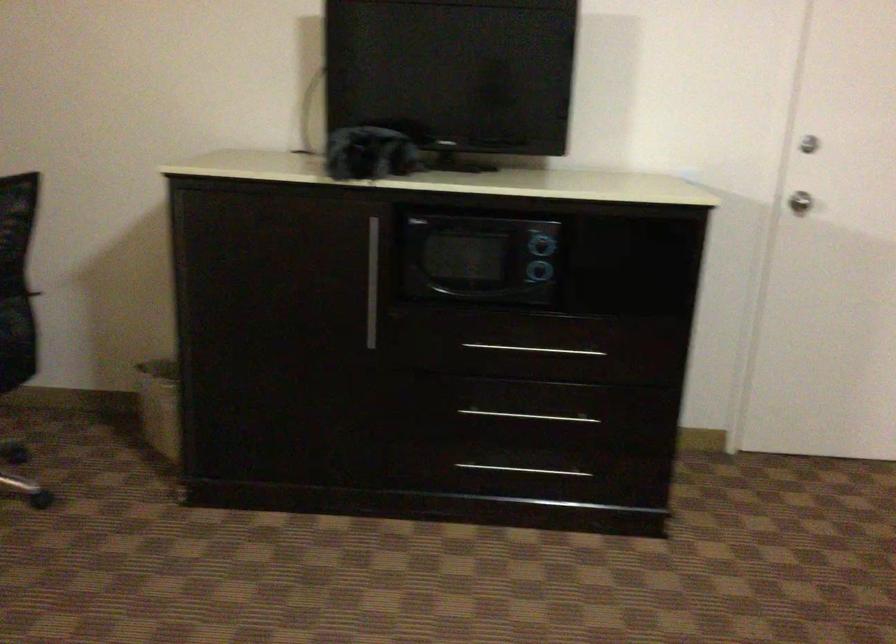
Image resolution: width=896 pixels, height=644 pixels. Describe the element at coordinates (483, 254) in the screenshot. I see `the microwave dial` at that location.